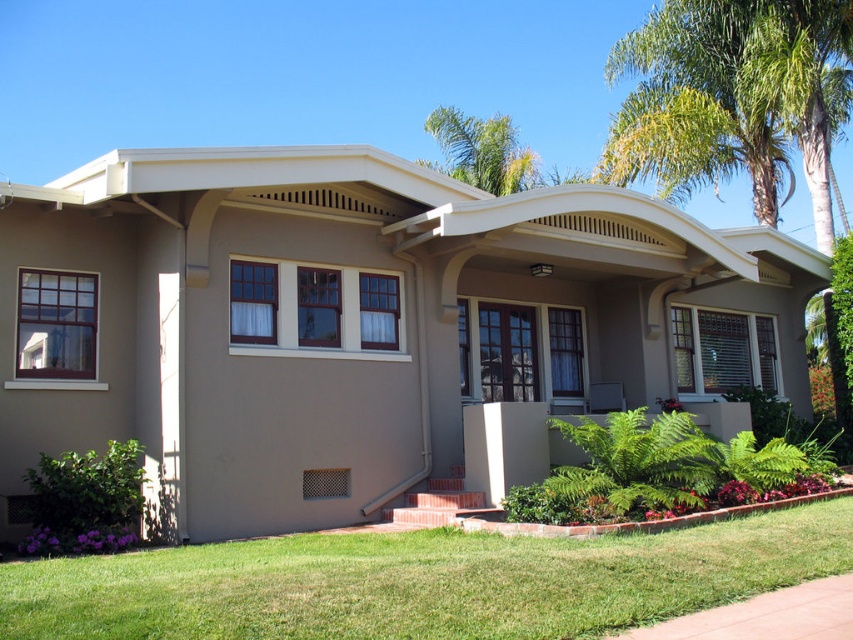
From the picture: You are standing in front of the house and want to plant a new flower bed between the green grass at lower center and the green leafy palm tree at upper right. Based on their positions, where should you place the flower bed?

The flower bed should be placed between the green grass at lower center and the green leafy palm tree at upper right, as the green grass at lower center is located below the green leafy palm tree at upper right.